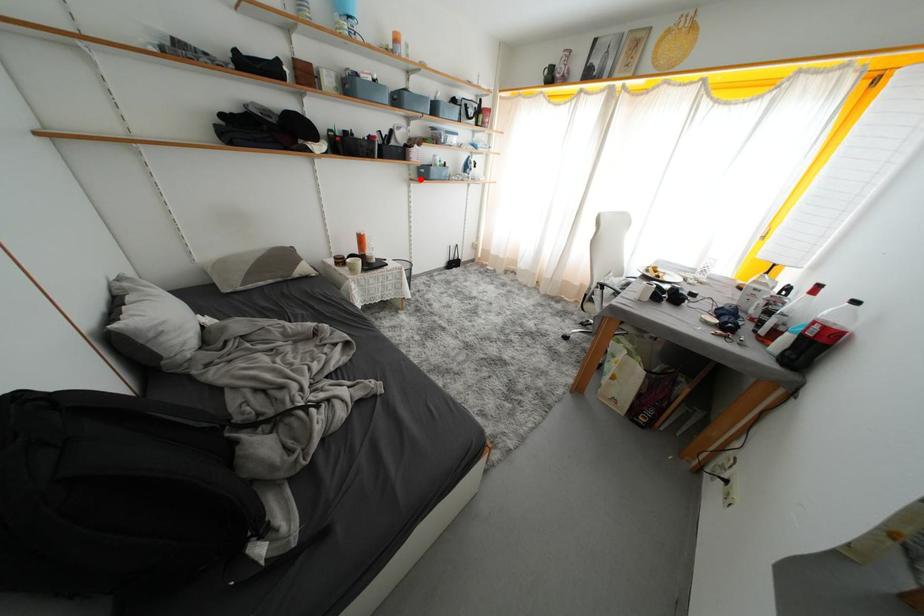
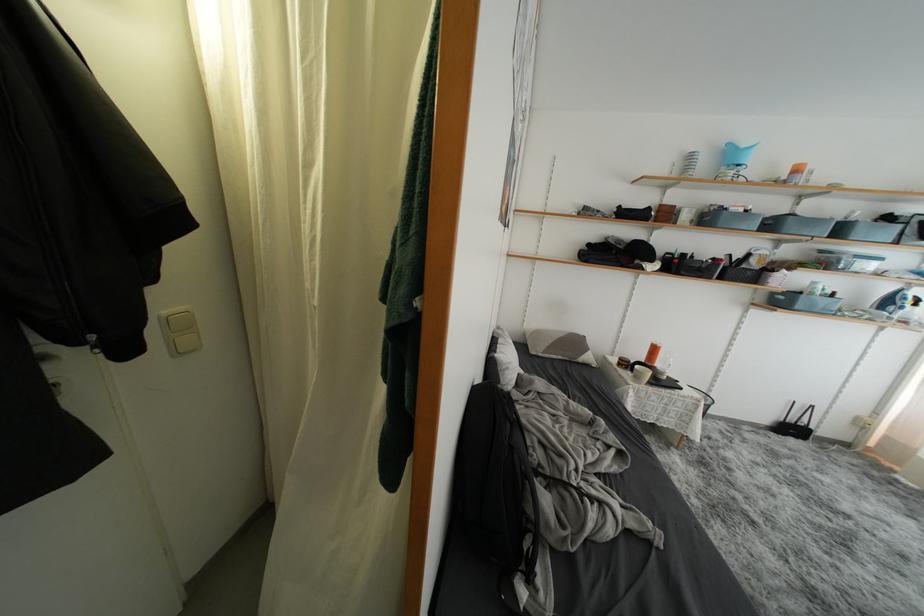
In the second image, find the point that corresponds to the highlighted location in the first image.

(767, 304)